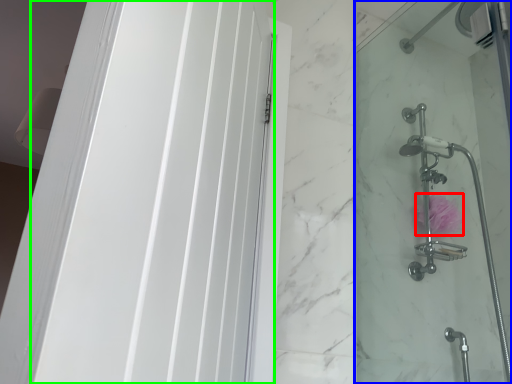
Question: Which is nearer to the flower (highlighted by a red box)? shower door (highlighted by a blue box) or screen door (highlighted by a green box).

Choices:
 (A) shower door
 (B) screen door

Answer: (A)